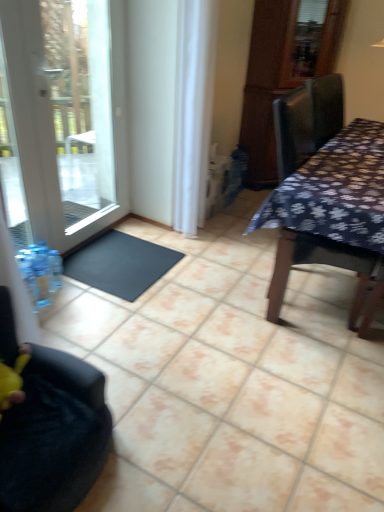
What are the coordinates of `empty space that is to the right of white glass door at left` in the screenshot? It's located at (193, 259).